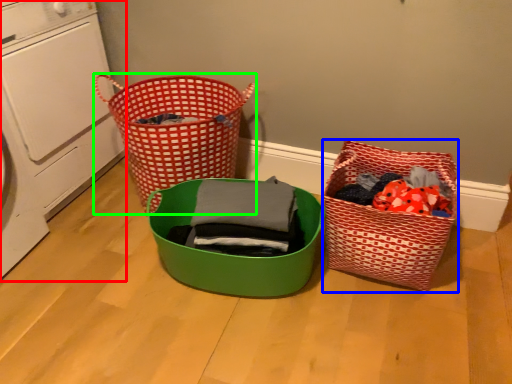
Question: Estimate the real-world distances between objects in this image. Which object is farther from washing machine (highlighted by a red box), basket (highlighted by a blue box) or waste container (highlighted by a green box)?

Choices:
 (A) basket
 (B) waste container

Answer: (A)